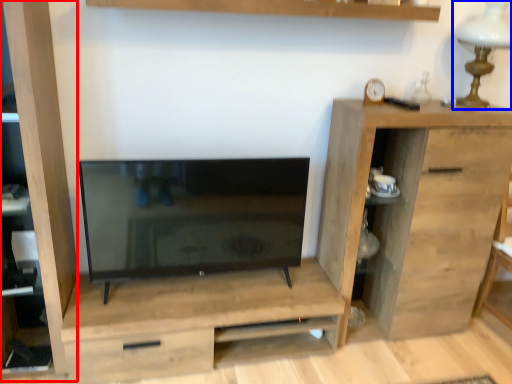
Question: Which of the following is the closest to the observer, cabinet (highlighted by a red box) or table lamp (highlighted by a blue box)?

Choices:
 (A) cabinet
 (B) table lamp

Answer: (A)